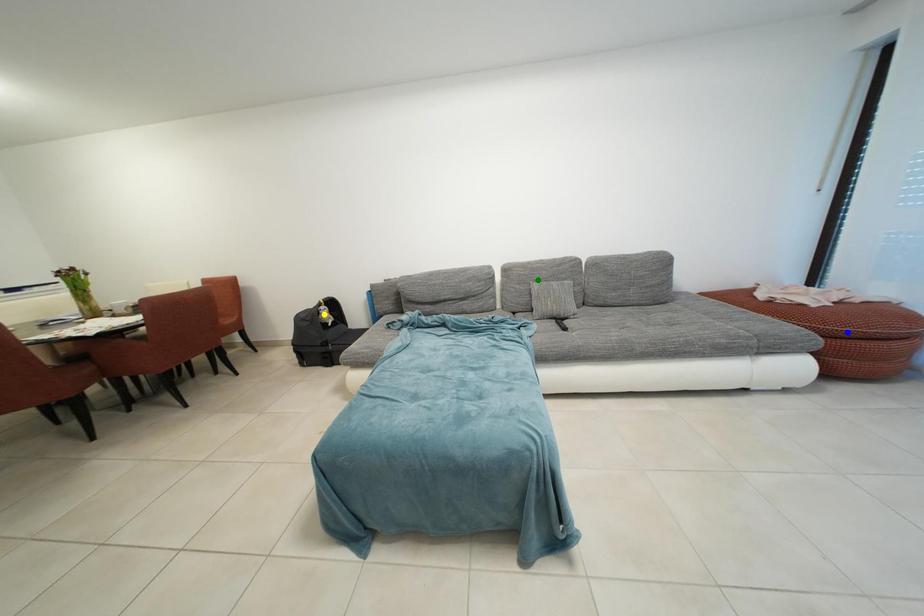
Order these from nearest to farthest:
yellow point | green point | blue point

blue point → green point → yellow point